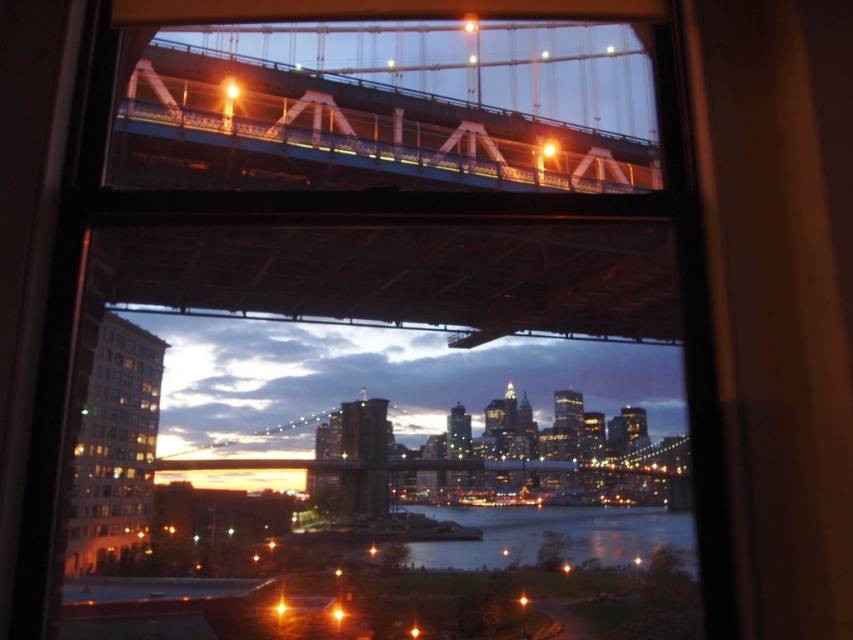
You are standing in a room with a large window. You see two points in the scene through the window. The first point is at coordinate point (105,358) and the second is at point (442,518). Which point is closer to you?

Point (105,358) is closer to you than point (442,518) because it is closer to the camera.

You are an architect reviewing a city model. You notice the matte glass building at lower left and the dark blue water at center. Which object occupies a larger horizontal space in the model?

The matte glass building at lower left occupies a larger horizontal space than the dark blue water at center because its width surpasses the water.